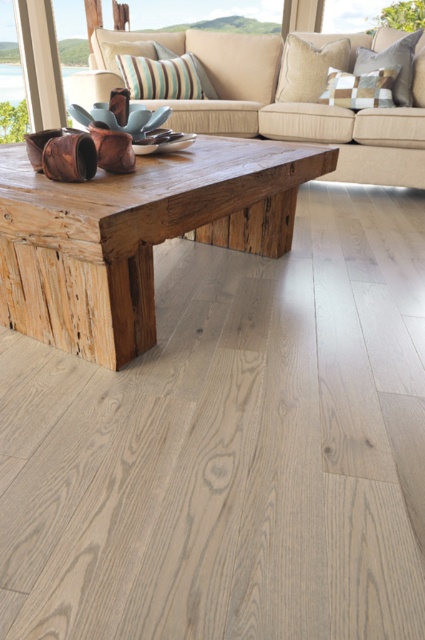
You are a person who wants to place a tall plant on the weathered wood coffee table at center so it can be seen from the beige fabric couch at center. Will the plant be visible from the couch?

The weathered wood coffee table at center has a lesser height compared to beige fabric couch at center, so the plant placed on the table may not be fully visible from the couch because the couch is taller than the table.

You are standing in the living room and want to place a new decorative item on the weathered wood coffee table at center. Based on its current position, can you determine if the table is positioned closer to the sofa or the entrance?

The weathered wood coffee table at center is located at point (135, 234), which suggests it is centrally positioned in the room, so it is equidistant from the sofa and the entrance.